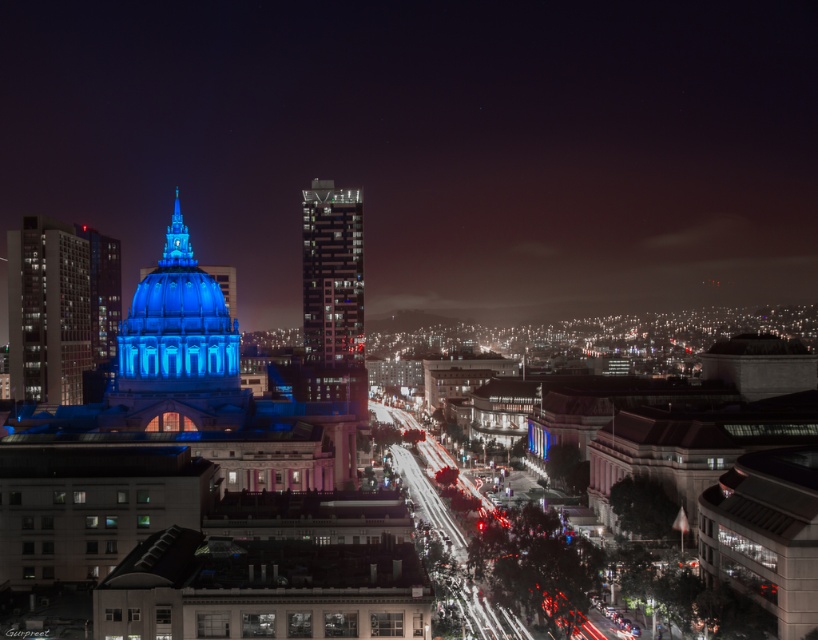
Is matte glass skyscraper at left smaller than glassy reflective skyscraper at center?

Indeed, matte glass skyscraper at left has a smaller size compared to glassy reflective skyscraper at center.

Does matte glass skyscraper at left lie behind glassy reflective skyscraper at center?

No, it is not.

Between point (16, 305) and point (321, 340), which one is positioned behind?

Positioned behind is point (321, 340).

Where is `matte glass skyscraper at left`? matte glass skyscraper at left is located at coordinates (47, 310).

Between blue glass dome at center and glassy reflective skyscraper at center, which one is positioned lower?

blue glass dome at center is lower down.

Which is in front, point (236, 342) or point (326, 317)?

Point (236, 342) is more forward.

Which is behind, point (194, 301) or point (322, 211)?

Point (322, 211)

You are a GUI agent. You are given a task and a screenshot of the screen. Output one action in this format:
    pyautogui.click(x=<x>, y=<y>)
    Task: Click on the blue glass dome at center
    
    Given the screenshot: What is the action you would take?
    pyautogui.click(x=178, y=326)

Does point (145, 337) come closer to viewer compared to point (77, 292)?

Yes, point (145, 337) is closer to viewer.

Does blue glass dome at center have a lesser width compared to matte glass skyscraper at left?

No.

Identify the location of blue glass dome at center. [x=178, y=326].